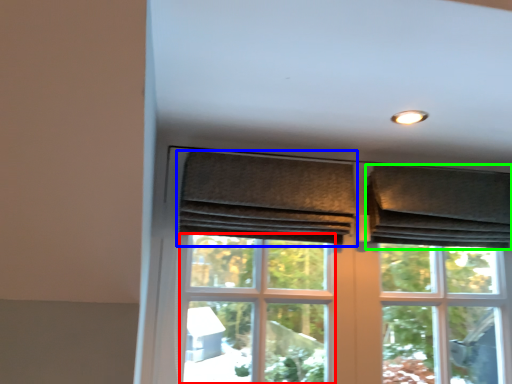
Question: Which is nearer to the screen door (highlighted by a red box)? curtain (highlighted by a blue box) or curtain (highlighted by a green box).

Choices:
 (A) curtain
 (B) curtain

Answer: (A)